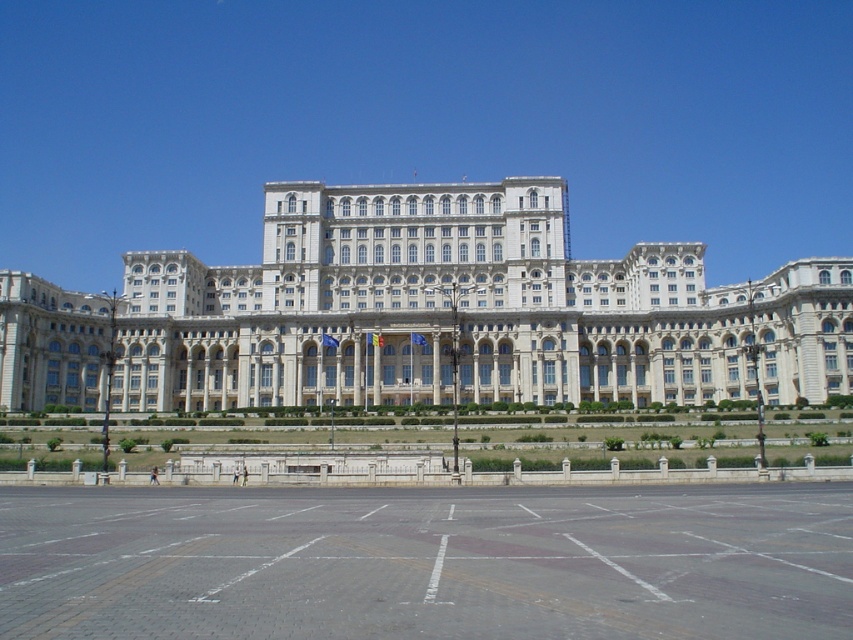
You are standing at point A, which is at coordinates (425, 314). You want to take a photo of the white stone building at center. Is the white stone building at center visible from your current position?

Yes, the white stone building at center is located at point A, so you are directly at its position and can clearly see it.